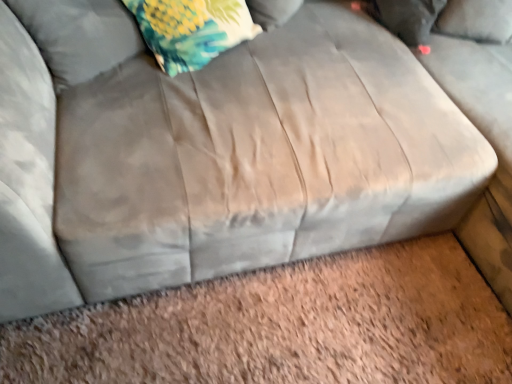
Question: Visually, is floral fabric pillow at upper left positioned to the left or to the right of floral fabric pillow at upper left, marked as the second pillow in a left-to-right arrangement?

Choices:
 (A) right
 (B) left

Answer: (B)

Question: From a real-world perspective, is floral fabric pillow at upper left physically located above or below floral fabric pillow at upper left, placed as the 1th pillow when sorted from back to front?

Choices:
 (A) below
 (B) above

Answer: (B)

Question: Which object is the farthest from the floral fabric pillow at upper left?

Choices:
 (A) fluffy fabric pillow at upper left, which appears as the first pillow when viewed from the front
 (B) floral fabric pillow at upper left, the 1th pillow from the right

Answer: (B)

Question: Which is farther from the floral fabric pillow at upper left?

Choices:
 (A) fluffy fabric pillow at upper left, the 2th pillow from the back
 (B) floral fabric pillow at upper left, placed as the 1th pillow when sorted from back to front

Answer: (B)